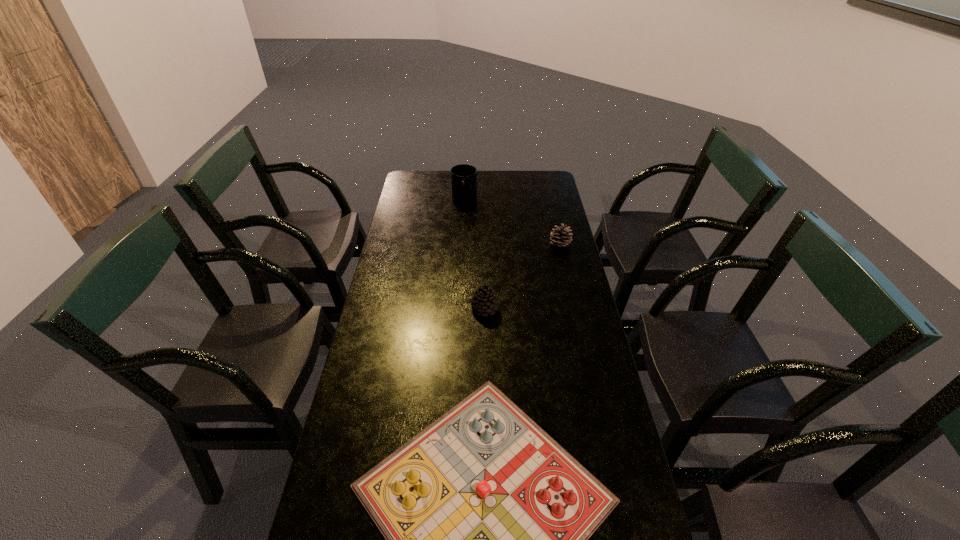
Where is `mug`? The height and width of the screenshot is (540, 960). mug is located at coordinates (463, 177).

Identify the location of the farthest object. (463, 177).

Locate an element on the screen. This screenshot has height=540, width=960. the left pinecone is located at coordinates (485, 301).

Identify the location of the third farthest object. The image size is (960, 540). (485, 301).

Find the location of a particular element. the second farthest object is located at coordinates (560, 237).

Where is `the right pinecone`? This screenshot has width=960, height=540. the right pinecone is located at coordinates (560, 237).

Locate an element on the screen. vacant area situated on the side of the mug with the handle is located at coordinates (463, 235).

Identify the location of vacant space located at the narrow end of the nearer pinecone. This screenshot has height=540, width=960. (485, 337).

Locate an element on the screen. The width and height of the screenshot is (960, 540). vacant space located on the front of the right pinecone is located at coordinates (579, 326).

The height and width of the screenshot is (540, 960). I want to click on object that is at the far edge, so click(463, 177).